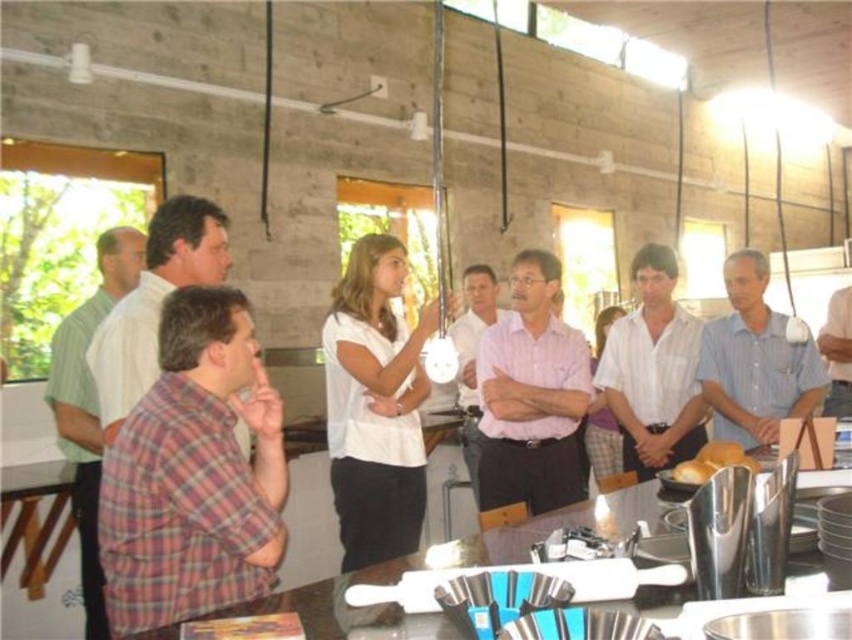
Question: Does golden bread at center have a lesser width compared to golden matte bread at center?

Choices:
 (A) no
 (B) yes

Answer: (A)

Question: Can you confirm if golden bread at center is positioned above golden matte bread at center?

Choices:
 (A) yes
 (B) no

Answer: (A)

Question: Which of the following is the closest to the observer?

Choices:
 (A) (635, 268)
 (B) (711, 476)

Answer: (B)

Question: Which object is the closest to the light blue shirt at center?

Choices:
 (A) plaid cotton shirt at left
 (B) pink shirt at center

Answer: (B)

Question: Which point is closer to the camera?

Choices:
 (A) (183, 196)
 (B) (170, 353)
 (C) (348, 500)
 (D) (718, 445)

Answer: (B)

Question: Does light blue shirt at center appear under pink cotton shirt at center?

Choices:
 (A) no
 (B) yes

Answer: (A)